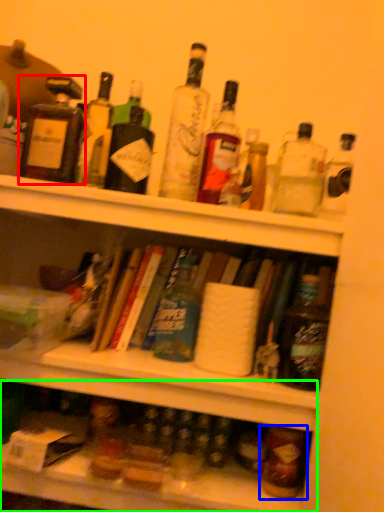
Question: Which object is the closest to the bottle (highlighted by a red box)? Choose among these: bottle (highlighted by a blue box) or shelf (highlighted by a green box).

Choices:
 (A) bottle
 (B) shelf

Answer: (B)